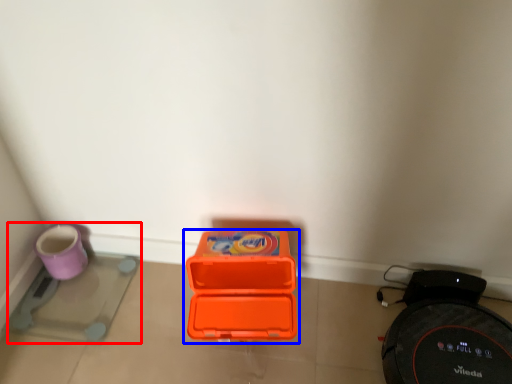
Question: Which of the following is the farthest to the observer, appliance (highlighted by a red box) or box (highlighted by a blue box)?

Choices:
 (A) appliance
 (B) box

Answer: (A)